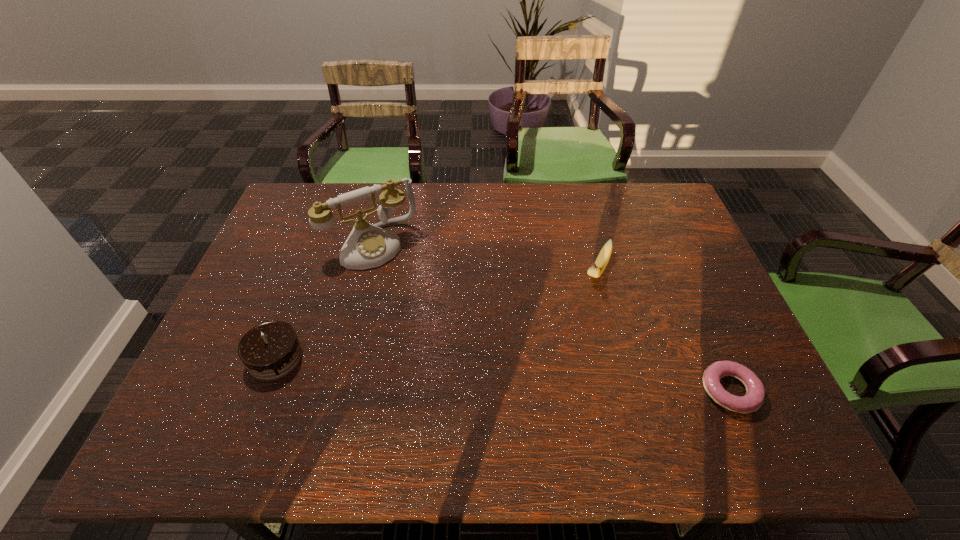
At what (x,y) coordinates should I click in order to perform the action: click on vacant area situated at the stem of the third object from left to right. Please return your answer as a coordinate pair (x, y). The image size is (960, 540). Looking at the image, I should click on (544, 383).

The width and height of the screenshot is (960, 540). I want to click on free space located at the stem of the third object from left to right, so [548, 376].

This screenshot has height=540, width=960. What are the coordinates of `blank area located 0.140m at the stem of the third object from left to right` in the screenshot? It's located at (575, 326).

Locate an element on the screen. object present at the far edge is located at coordinates (368, 246).

The width and height of the screenshot is (960, 540). I want to click on chocolate cake situated at the near edge, so click(271, 350).

Where is `doughnut located in the near edge section of the desktop`? The height and width of the screenshot is (540, 960). doughnut located in the near edge section of the desktop is located at coordinates (755, 392).

I want to click on object located in the left edge section of the desktop, so click(x=271, y=350).

Identify the location of object that is at the right edge. (755, 392).

Where is `object located at the near left corner`? object located at the near left corner is located at coordinates point(271,350).

The height and width of the screenshot is (540, 960). I want to click on object that is positioned at the near right corner, so click(x=755, y=392).